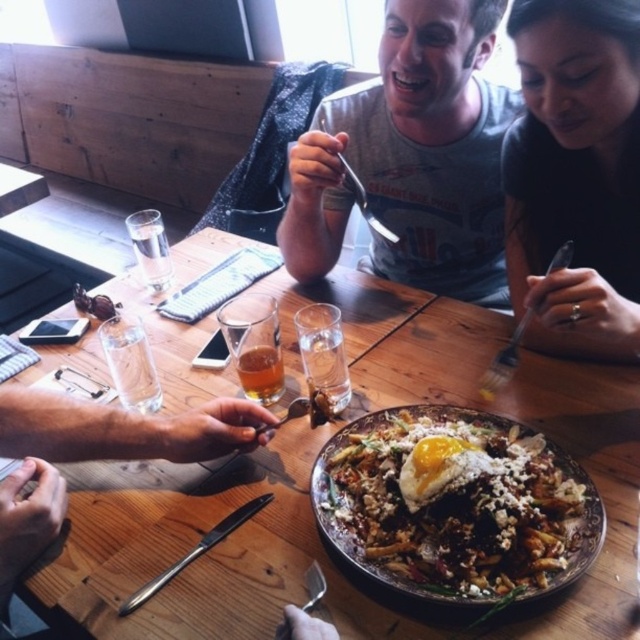
Question: Is wooden table at center closer to camera compared to gray cotton t-shirt at center?

Choices:
 (A) no
 (B) yes

Answer: (B)

Question: Is golden fried egg at center to the right of black matte fork at upper right from the viewer's perspective?

Choices:
 (A) yes
 (B) no

Answer: (B)

Question: Which of the following is the closest to the observer?

Choices:
 (A) gray cotton t-shirt at center
 (B) wooden table at center

Answer: (B)

Question: Does gray cotton t-shirt at center have a lesser width compared to brushed metal fork at upper right?

Choices:
 (A) no
 (B) yes

Answer: (A)

Question: Which point is farther to the camera?

Choices:
 (A) brushed metal fork at upper right
 (B) gray cotton t-shirt at center
 (C) golden fried egg at center
 (D) black matte fork at upper right

Answer: (B)

Question: Among these objects, which one is farthest from the camera?

Choices:
 (A) brushed metal fork at upper right
 (B) wooden table at center
 (C) gray cotton t-shirt at center
 (D) golden fried egg at center

Answer: (C)